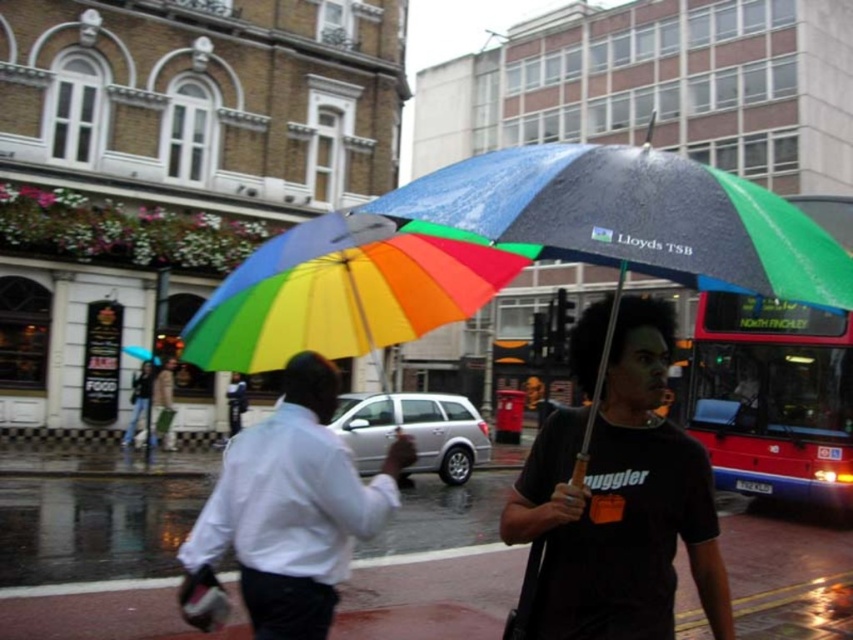
Which is above, shiny asphalt pavement at lower center or rainbow fabric umbrella at center?

Positioned higher is rainbow fabric umbrella at center.

Identify the location of shiny asphalt pavement at lower center. Image resolution: width=853 pixels, height=640 pixels. (434, 568).

Can you confirm if shiny asphalt pavement at lower center is taller than white shirt at center?

No, shiny asphalt pavement at lower center is not taller than white shirt at center.

Can you confirm if shiny asphalt pavement at lower center is positioned below white shirt at center?

Indeed, shiny asphalt pavement at lower center is positioned under white shirt at center.

What do you see at coordinates (434, 568) in the screenshot? This screenshot has height=640, width=853. I see `shiny asphalt pavement at lower center` at bounding box center [434, 568].

The height and width of the screenshot is (640, 853). Identify the location of shiny asphalt pavement at lower center. (434, 568).

Can you confirm if white shirt at center is smaller than red metallic bus at right?

Yes, white shirt at center is smaller than red metallic bus at right.

Does point (274, 435) come closer to viewer compared to point (688, 420)?

Yes, point (274, 435) is in front of point (688, 420).

Who is more forward, (187, 604) or (781, 465)?

Point (187, 604) is more forward.

Locate an element on the screen. The width and height of the screenshot is (853, 640). white shirt at center is located at coordinates (287, 513).